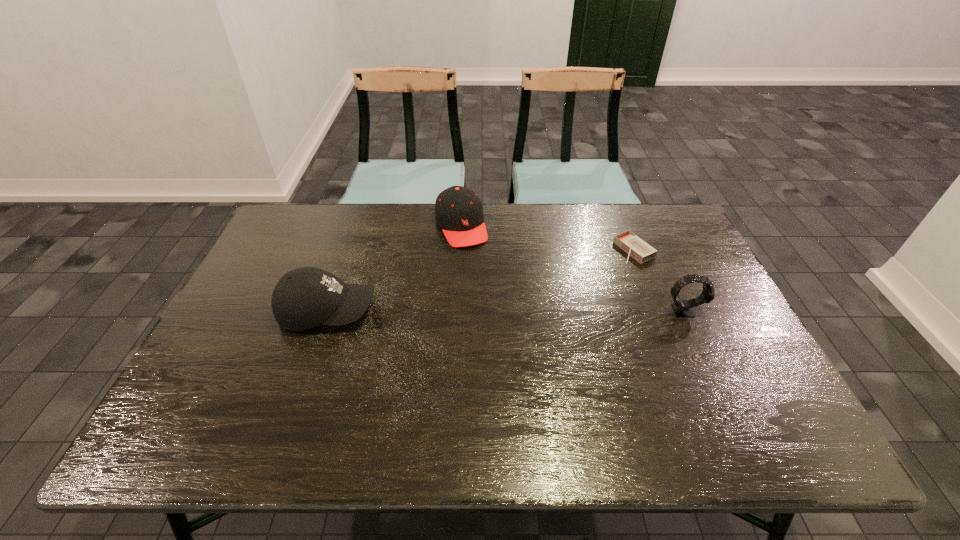
Locate an element on the screen. baseball cap is located at coordinates (303, 298).

I want to click on watch, so click(683, 308).

Find the location of `cap`. cap is located at coordinates (458, 210).

Image resolution: width=960 pixels, height=540 pixels. I want to click on matchbox, so click(637, 248).

This screenshot has height=540, width=960. Find the location of `vacant region located on the front-facing side of the leftmost object`. vacant region located on the front-facing side of the leftmost object is located at coordinates (473, 311).

The width and height of the screenshot is (960, 540). I want to click on free space located 0.070m on the front-facing side of the third object from right to left, so click(474, 262).

Find the location of `vacant space located on the front-facing side of the third object from right to left`. vacant space located on the front-facing side of the third object from right to left is located at coordinates (486, 288).

The height and width of the screenshot is (540, 960). Find the location of `vacant position located 0.160m on the front-facing side of the third object from right to left`. vacant position located 0.160m on the front-facing side of the third object from right to left is located at coordinates (483, 281).

The height and width of the screenshot is (540, 960). What are the coordinates of `free space located on the striking surface of the matchbox` in the screenshot? It's located at (583, 274).

At what (x,y) coordinates should I click in order to perform the action: click on vacant space located 0.360m on the striking surface of the matchbox. Please return your answer as a coordinate pair (x, y). The width and height of the screenshot is (960, 540). Looking at the image, I should click on (524, 300).